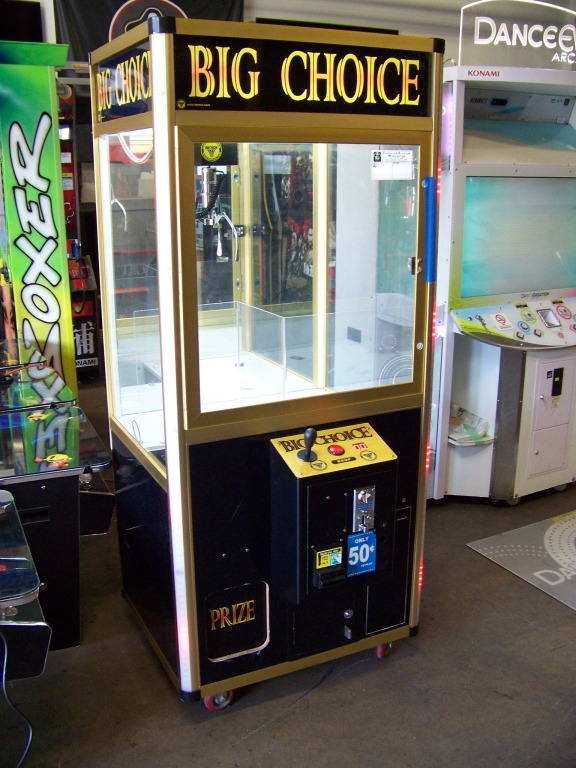
At what (x,y) coordinates should I click in order to perform the action: click on arcade machine. Please return your answer as a coordinate pair (x, y). Looking at the image, I should click on [x=53, y=488], [x=486, y=376], [x=242, y=540], [x=82, y=310], [x=304, y=239], [x=37, y=647].